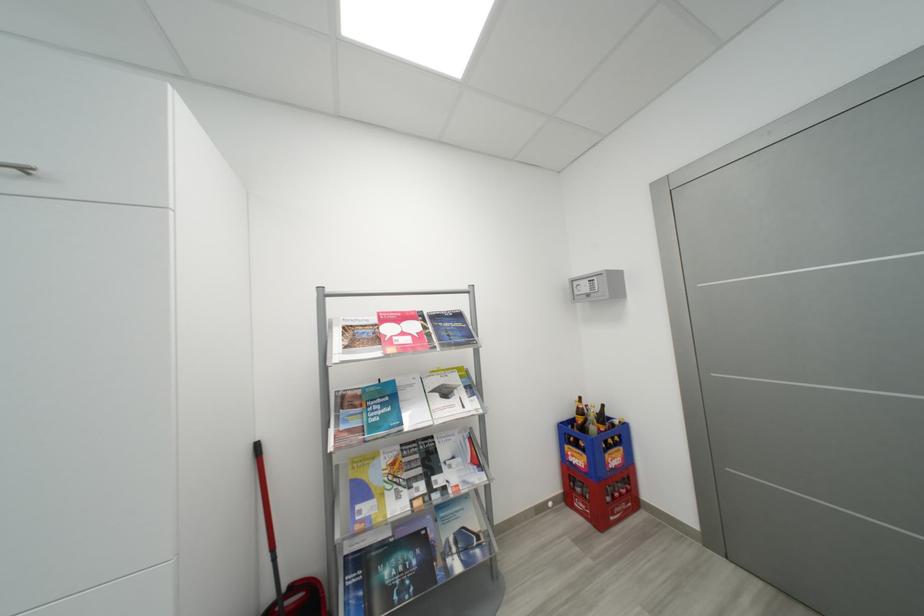
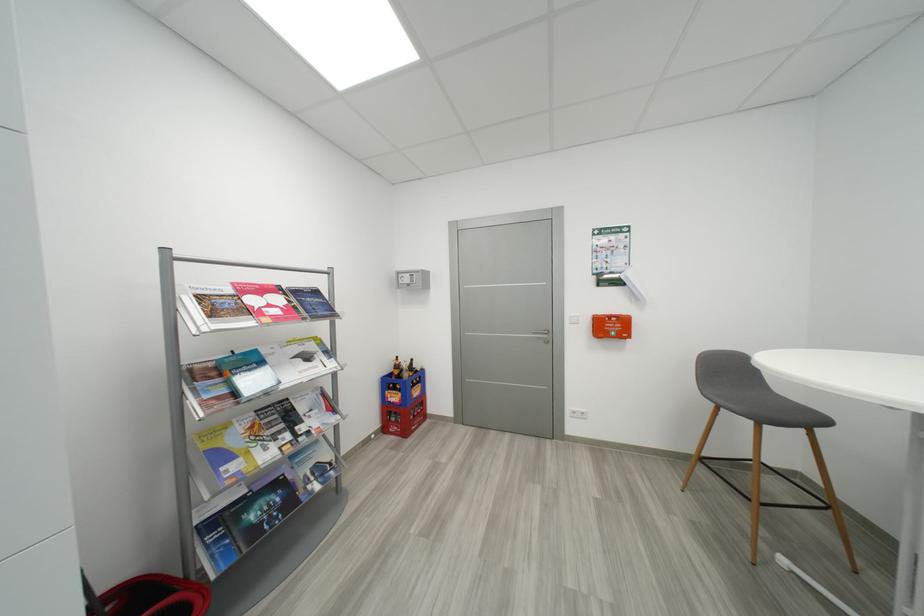
Locate, in the second image, the point that corresponds to point (578, 424) in the first image.

(397, 377)